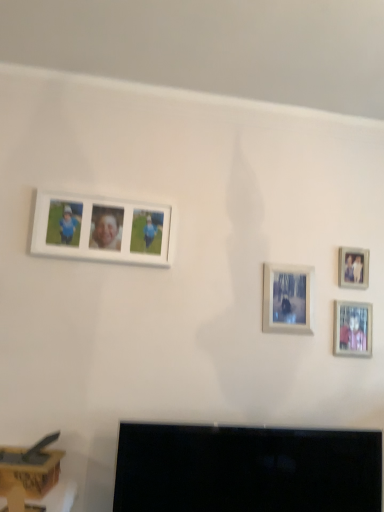
This screenshot has width=384, height=512. I want to click on matte silver photo frame at lower right, which is the 3th picture frame in left-to-right order, so click(x=352, y=329).

In order to face wooden box at lower left, should I rotate leftwards or rightwards?

Turn left approximately 22.569 degrees to face it.

The image size is (384, 512). In order to click on black glossy tv at lower center in this screenshot , I will do `click(246, 469)`.

You are a GUI agent. You are given a task and a screenshot of the screen. Output one action in this format:
    pyautogui.click(x=<x>, y=<y>)
    Task: Click on the matte white picture frame at center, the second picture frame in the left-to-right sequence
    The width and height of the screenshot is (384, 512).
    Given the screenshot: What is the action you would take?
    [x=288, y=298]

In the scene shown: Is white matte photo frame at upper left, which ranks as the 1th picture frame in left-to-right order, facing towards matte white picture frame at center, the 3th picture frame viewed from the right?

No, white matte photo frame at upper left, which ranks as the 1th picture frame in left-to-right order, is not oriented towards matte white picture frame at center, the 3th picture frame viewed from the right.

Is white matte photo frame at upper left, placed as the 4th picture frame when sorted from right to left, not within matte white picture frame at center, the second picture frame in the left-to-right sequence?

That's correct, white matte photo frame at upper left, placed as the 4th picture frame when sorted from right to left, is outside of matte white picture frame at center, the second picture frame in the left-to-right sequence.

From the image's perspective, is white matte photo frame at upper left, which ranks as the 1th picture frame in left-to-right order, on matte white picture frame at center, the 3th picture frame viewed from the right?

Yes, from the image's perspective, white matte photo frame at upper left, which ranks as the 1th picture frame in left-to-right order, is above matte white picture frame at center, the 3th picture frame viewed from the right.

From a real-world perspective, does white matte photo frame at upper left, which ranks as the 1th picture frame in left-to-right order, sit lower than matte white picture frame at center, the second picture frame in the left-to-right sequence?

No, from a real-world perspective, white matte photo frame at upper left, which ranks as the 1th picture frame in left-to-right order, is not beneath matte white picture frame at center, the second picture frame in the left-to-right sequence.

Does black glossy tv at lower center have a larger size compared to matte silver photo frame at lower right, which is the 3th picture frame in left-to-right order?

Indeed, black glossy tv at lower center has a larger size compared to matte silver photo frame at lower right, which is the 3th picture frame in left-to-right order.

Is black glossy tv at lower center thinner than matte silver photo frame at lower right, which is the 3th picture frame in left-to-right order?

No, black glossy tv at lower center is not thinner than matte silver photo frame at lower right, which is the 3th picture frame in left-to-right order.

Which is more to the right, black glossy tv at lower center or matte silver photo frame at lower right, which is the 3th picture frame in left-to-right order?

From the viewer's perspective, matte silver photo frame at lower right, which is the 3th picture frame in left-to-right order, appears more on the right side.

Is matte silver photo frame at lower right, which is counted as the second picture frame, starting from the right, located within black glossy tv at lower center?

No, matte silver photo frame at lower right, which is counted as the second picture frame, starting from the right, is not surrounded by black glossy tv at lower center.

Based on their sizes in the image, would you say black glossy tv at lower center is bigger or smaller than wooden photo frame at upper right, which appears as the 4th picture frame when viewed from the left?

Clearly, black glossy tv at lower center is larger in size than wooden photo frame at upper right, which appears as the 4th picture frame when viewed from the left.

In the scene shown: Is black glossy tv at lower center oriented towards wooden photo frame at upper right, which appears as the 4th picture frame when viewed from the left?

No.

Looking at this image, between black glossy tv at lower center and wooden photo frame at upper right, which appears as the 4th picture frame when viewed from the left, which one appears on the right side from the viewer's perspective?

Positioned to the right is wooden photo frame at upper right, which appears as the 4th picture frame when viewed from the left.

Which is closer to the camera, (348, 326) or (365, 500)?

Point (348, 326) is positioned farther from the camera compared to point (365, 500).

Considering the relative sizes of matte silver photo frame at lower right, which is the 3th picture frame in left-to-right order, and black glossy tv at lower center in the image provided, is matte silver photo frame at lower right, which is the 3th picture frame in left-to-right order, shorter than black glossy tv at lower center?

Correct, matte silver photo frame at lower right, which is the 3th picture frame in left-to-right order, is not as tall as black glossy tv at lower center.

Is matte silver photo frame at lower right, which is the 3th picture frame in left-to-right order, not inside black glossy tv at lower center?

Indeed, matte silver photo frame at lower right, which is the 3th picture frame in left-to-right order, is completely outside black glossy tv at lower center.

Between matte silver photo frame at lower right, which is the 3th picture frame in left-to-right order, and black glossy tv at lower center, which one appears on the right side from the viewer's perspective?

matte silver photo frame at lower right, which is the 3th picture frame in left-to-right order.

What's the angular difference between wooden photo frame at upper right, which appears as the 4th picture frame when viewed from the left, and black glossy tv at lower center's facing directions?

The angle between the facing direction of wooden photo frame at upper right, which appears as the 4th picture frame when viewed from the left, and the facing direction of black glossy tv at lower center is 3.48 degrees.

Considering the sizes of wooden photo frame at upper right, which appears as the 4th picture frame when viewed from the left, and black glossy tv at lower center in the image, is wooden photo frame at upper right, which appears as the 4th picture frame when viewed from the left, wider or thinner than black glossy tv at lower center?

In the image, wooden photo frame at upper right, which appears as the 4th picture frame when viewed from the left, appears to be more narrow than black glossy tv at lower center.

Considering the sizes of objects wooden photo frame at upper right, which appears as the 4th picture frame when viewed from the left, and black glossy tv at lower center in the image provided, who is bigger, wooden photo frame at upper right, which appears as the 4th picture frame when viewed from the left, or black glossy tv at lower center?

black glossy tv at lower center is bigger.

Measure the distance from wooden photo frame at upper right, the first picture frame when ordered from right to left, to black glossy tv at lower center.

A distance of 81.12 centimeters exists between wooden photo frame at upper right, the first picture frame when ordered from right to left, and black glossy tv at lower center.

In order to click on the 3rd picture frame counting from the left of the wooden photo frame at upper right, the first picture frame when ordered from right to left in this screenshot , I will do `click(101, 229)`.

Considering the relative sizes of white matte photo frame at upper left, which ranks as the 1th picture frame in left-to-right order, and wooden photo frame at upper right, the first picture frame when ordered from right to left, in the image provided, is white matte photo frame at upper left, which ranks as the 1th picture frame in left-to-right order, shorter than wooden photo frame at upper right, the first picture frame when ordered from right to left,?

No, white matte photo frame at upper left, which ranks as the 1th picture frame in left-to-right order, is not shorter than wooden photo frame at upper right, the first picture frame when ordered from right to left.

From the picture: Which object is closer to the camera taking this photo, white matte photo frame at upper left, which ranks as the 1th picture frame in left-to-right order, or wooden photo frame at upper right, the first picture frame when ordered from right to left?

white matte photo frame at upper left, which ranks as the 1th picture frame in left-to-right order, is in front.

Based on the photo, is white matte photo frame at upper left, which ranks as the 1th picture frame in left-to-right order, inside the boundaries of wooden photo frame at upper right, which appears as the 4th picture frame when viewed from the left, or outside?

white matte photo frame at upper left, which ranks as the 1th picture frame in left-to-right order, is spatially situated outside wooden photo frame at upper right, which appears as the 4th picture frame when viewed from the left.

Is there a large distance between matte silver photo frame at lower right, which is counted as the second picture frame, starting from the right, and matte white picture frame at center, the 3th picture frame viewed from the right?

matte silver photo frame at lower right, which is counted as the second picture frame, starting from the right, is actually quite close to matte white picture frame at center, the 3th picture frame viewed from the right.

Considering the relative positions of matte silver photo frame at lower right, which is the 3th picture frame in left-to-right order, and matte white picture frame at center, the second picture frame in the left-to-right sequence, in the image provided, is matte silver photo frame at lower right, which is the 3th picture frame in left-to-right order, behind matte white picture frame at center, the second picture frame in the left-to-right sequence,?

Yes, matte silver photo frame at lower right, which is the 3th picture frame in left-to-right order, is further from the viewer.

Can you tell me how much matte silver photo frame at lower right, which is counted as the second picture frame, starting from the right, and matte white picture frame at center, the 3th picture frame viewed from the right, differ in facing direction?

The angular difference between matte silver photo frame at lower right, which is counted as the second picture frame, starting from the right, and matte white picture frame at center, the 3th picture frame viewed from the right, is 1.44 degrees.

Is matte silver photo frame at lower right, which is counted as the second picture frame, starting from the right, to the left or to the right of matte white picture frame at center, the 3th picture frame viewed from the right, in the image?

Based on their positions, matte silver photo frame at lower right, which is counted as the second picture frame, starting from the right, is located to the right of matte white picture frame at center, the 3th picture frame viewed from the right.

Where is `picture frame in front of the matte white picture frame at center, the second picture frame in the left-to-right sequence`? picture frame in front of the matte white picture frame at center, the second picture frame in the left-to-right sequence is located at coordinates (101, 229).

The image size is (384, 512). I want to click on picture frame that is the 2nd one when counting rightward from the black glossy tv at lower center, so click(352, 329).

From the image, which object appears to be nearer to wooden box at lower left, matte silver photo frame at lower right, which is the 3th picture frame in left-to-right order, or matte white picture frame at center, the 3th picture frame viewed from the right?

The object closer to wooden box at lower left is matte white picture frame at center, the 3th picture frame viewed from the right.

Which object lies nearer to the anchor point matte silver photo frame at lower right, which is the 3th picture frame in left-to-right order, matte white picture frame at center, the 3th picture frame viewed from the right, or wooden photo frame at upper right, which appears as the 4th picture frame when viewed from the left?

Among the two, wooden photo frame at upper right, which appears as the 4th picture frame when viewed from the left, is located nearer to matte silver photo frame at lower right, which is the 3th picture frame in left-to-right order.

When comparing their distances from wooden photo frame at upper right, which appears as the 4th picture frame when viewed from the left, does matte silver photo frame at lower right, which is counted as the second picture frame, starting from the right, or matte white picture frame at center, the second picture frame in the left-to-right sequence, seem closer?

matte silver photo frame at lower right, which is counted as the second picture frame, starting from the right, is positioned closer to the anchor wooden photo frame at upper right, which appears as the 4th picture frame when viewed from the left.

From the image, which object appears to be nearer to matte white picture frame at center, the second picture frame in the left-to-right sequence, wooden photo frame at upper right, the first picture frame when ordered from right to left, or matte silver photo frame at lower right, which is counted as the second picture frame, starting from the right?

The object closer to matte white picture frame at center, the second picture frame in the left-to-right sequence, is matte silver photo frame at lower right, which is counted as the second picture frame, starting from the right.

Looking at this image, from the image, which object appears to be farther from wooden photo frame at upper right, the first picture frame when ordered from right to left, wooden box at lower left or matte silver photo frame at lower right, which is counted as the second picture frame, starting from the right?

wooden box at lower left lies further to wooden photo frame at upper right, the first picture frame when ordered from right to left, than the other object.

When comparing their distances from matte white picture frame at center, the 3th picture frame viewed from the right, does wooden box at lower left or wooden photo frame at upper right, the first picture frame when ordered from right to left, seem closer?

The object closer to matte white picture frame at center, the 3th picture frame viewed from the right, is wooden photo frame at upper right, the first picture frame when ordered from right to left.

Looking at the image, which one is located closer to black glossy tv at lower center, matte silver photo frame at lower right, which is counted as the second picture frame, starting from the right, or wooden box at lower left?

Based on the image, wooden box at lower left appears to be nearer to black glossy tv at lower center.

From the image, which object appears to be farther from black glossy tv at lower center, matte silver photo frame at lower right, which is the 3th picture frame in left-to-right order, or wooden photo frame at upper right, which appears as the 4th picture frame when viewed from the left?

wooden photo frame at upper right, which appears as the 4th picture frame when viewed from the left, is further to black glossy tv at lower center.

I want to click on television situated between white matte photo frame at upper left, placed as the 4th picture frame when sorted from right to left, and wooden photo frame at upper right, which appears as the 4th picture frame when viewed from the left, from left to right, so click(x=246, y=469).

Where is `television between wooden box at lower left and matte silver photo frame at lower right, which is counted as the second picture frame, starting from the right, in the horizontal direction`? television between wooden box at lower left and matte silver photo frame at lower right, which is counted as the second picture frame, starting from the right, in the horizontal direction is located at coordinates (246, 469).

Identify the location of picture frame between white matte photo frame at upper left, placed as the 4th picture frame when sorted from right to left, and matte silver photo frame at lower right, which is the 3th picture frame in left-to-right order. The width and height of the screenshot is (384, 512). (288, 298).

I want to click on picture frame that lies between matte white picture frame at center, the 3th picture frame viewed from the right, and black glossy tv at lower center from top to bottom, so click(x=352, y=329).